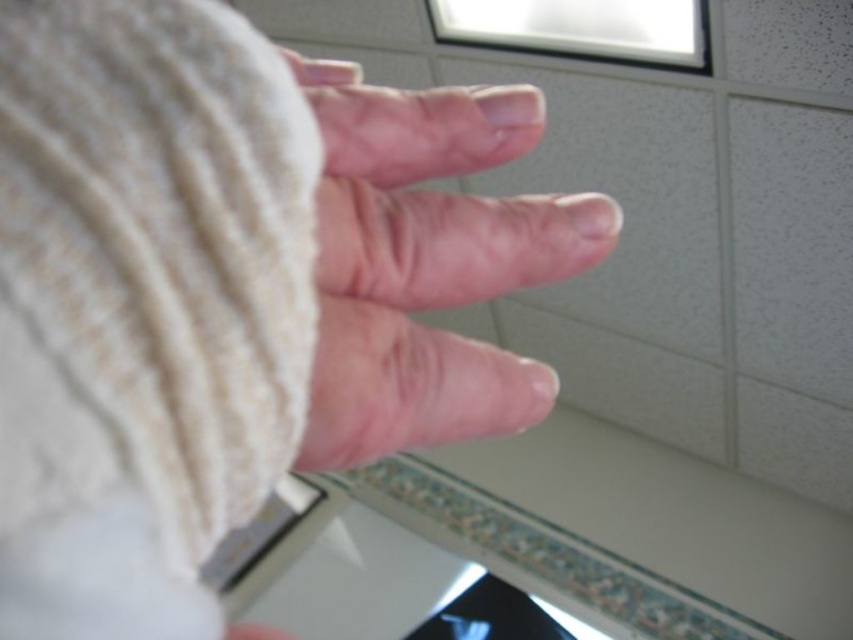
Question: Which object appears closest to the camera in this image?

Choices:
 (A) pink flesh at center
 (B) white knitted hand at center

Answer: (B)

Question: Where is white knitted hand at center located in relation to pink flesh at center in the image?

Choices:
 (A) below
 (B) above

Answer: (A)

Question: Which point is closer to the camera taking this photo?

Choices:
 (A) (422, 106)
 (B) (299, 147)

Answer: (B)

Question: Which point appears closest to the camera in this image?

Choices:
 (A) (321, 196)
 (B) (500, 384)

Answer: (A)

Question: Can you confirm if white knitted hand at center is wider than pink flesh at center?

Choices:
 (A) no
 (B) yes

Answer: (B)

Question: From the image, what is the correct spatial relationship of white knitted hand at center in relation to pink flesh at center?

Choices:
 (A) left
 (B) right

Answer: (A)